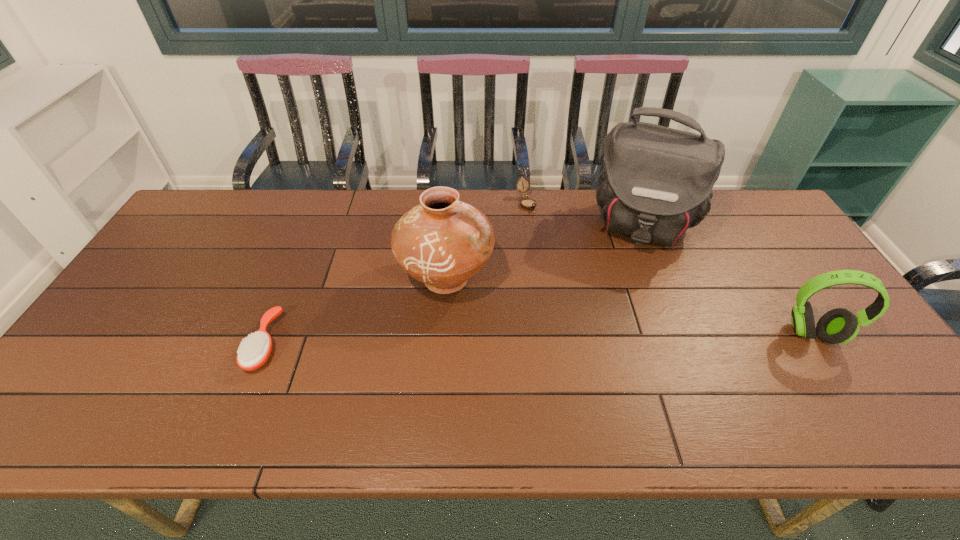
The width and height of the screenshot is (960, 540). In order to click on hairbrush in this screenshot , I will do `click(253, 353)`.

Where is `the leftmost object`? Image resolution: width=960 pixels, height=540 pixels. the leftmost object is located at coordinates (253, 353).

I want to click on the third tallest object, so click(838, 326).

Locate an element on the screen. The width and height of the screenshot is (960, 540). the rightmost object is located at coordinates (838, 326).

The image size is (960, 540). Find the location of `the third object from left to right`. the third object from left to right is located at coordinates (527, 203).

Find the location of `compass`. compass is located at coordinates (527, 203).

At what (x,y) coordinates should I click in order to perform the action: click on pottery. Please return your answer as a coordinate pair (x, y). The height and width of the screenshot is (540, 960). Looking at the image, I should click on (442, 242).

The height and width of the screenshot is (540, 960). I want to click on the second tallest object, so click(x=442, y=242).

Where is `shoulder bag`? shoulder bag is located at coordinates (656, 182).

Find the location of a particular element. This screenshot has height=540, width=960. the fourth object from left to right is located at coordinates (656, 182).